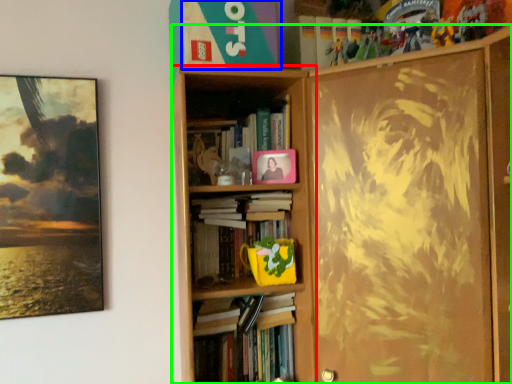
Question: Based on their relative distances, which object is nearer to bookcase (highlighted by a red box)? Choose from paperback book (highlighted by a blue box) and bookcase (highlighted by a green box).

Choices:
 (A) paperback book
 (B) bookcase

Answer: (B)